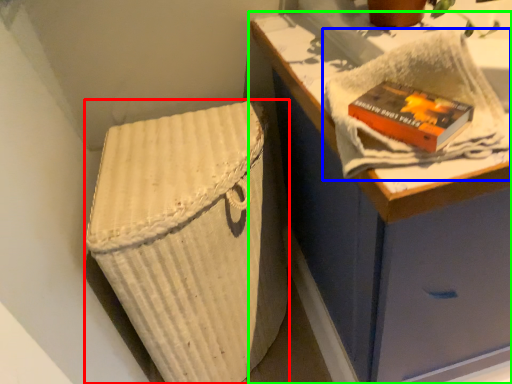
Question: Which object is the closest to the laundry basket (highlighted by a red box)? Choose among these: bath towel (highlighted by a blue box) or furniture (highlighted by a green box).

Choices:
 (A) bath towel
 (B) furniture

Answer: (B)